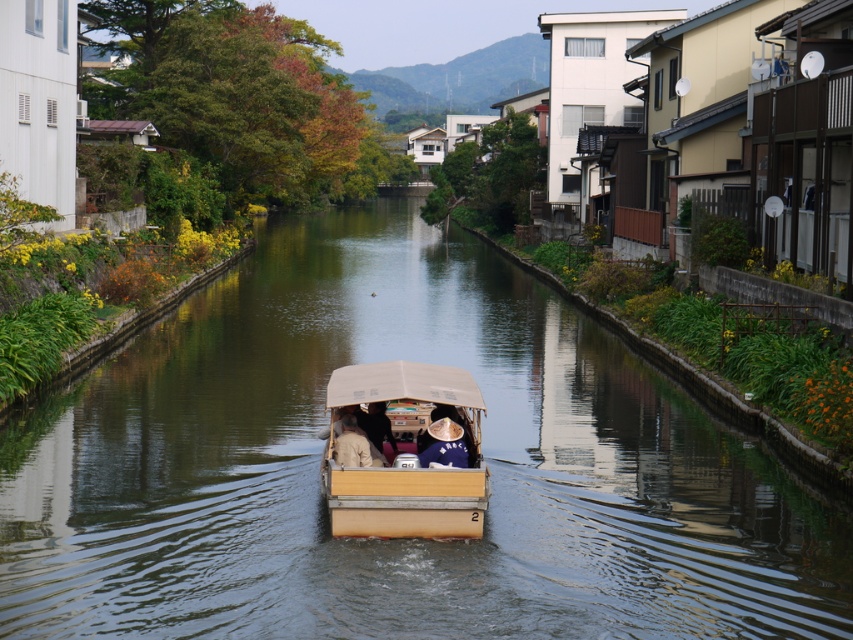
Between wooden boat at center and brown straw hat at center, which one is positioned higher?

wooden boat at center is above.

Between point (358, 385) and point (431, 436), which one is positioned behind?

The point (358, 385) is behind.

The width and height of the screenshot is (853, 640). Find the location of `wooden boat at center`. wooden boat at center is located at coordinates (405, 500).

Find the location of a particular element. This screenshot has width=853, height=640. brown wooden boat at center is located at coordinates (398, 540).

I want to click on brown wooden boat at center, so click(398, 540).

Between wooden boat at center and light brown fabric hat at center, which one appears on the left side from the viewer's perspective?

light brown fabric hat at center

Is point (457, 388) closer to camera compared to point (357, 452)?

No, it is behind (357, 452).

This screenshot has width=853, height=640. Identify the location of wooden boat at center. (405, 500).